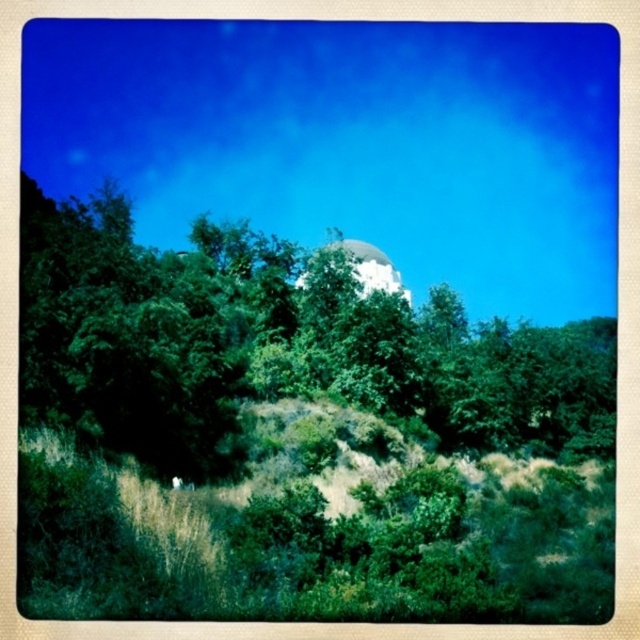
Looking at this image, is green leafy tree at center positioned before white glossy dome at center?

That is True.

Based on the photo, can you confirm if green leafy tree at center is wider than white glossy dome at center?

Yes.

Does point (268, 394) come closer to viewer compared to point (381, 282)?

Yes, point (268, 394) is in front of point (381, 282).

Locate an element on the screen. Image resolution: width=640 pixels, height=640 pixels. green leafy tree at center is located at coordinates (275, 346).

Is point (132, 452) behind point (211, 506)?

Yes, it is behind point (211, 506).

Between point (321, 280) and point (76, 458), which one is positioned in front?

Point (76, 458) is more forward.

Find the location of `green leafy tree at center`. green leafy tree at center is located at coordinates pyautogui.click(x=275, y=346).

Consider the image. Which is more to the right, green grassy hillside at lower center or white glossy dome at center?

From the viewer's perspective, green grassy hillside at lower center appears more on the right side.

Can you confirm if green grassy hillside at lower center is positioned above white glossy dome at center?

Incorrect, green grassy hillside at lower center is not positioned above white glossy dome at center.

Between point (356, 436) and point (371, 280), which one is positioned behind?

Positioned behind is point (371, 280).

This screenshot has width=640, height=640. I want to click on green grassy hillside at lower center, so click(x=317, y=532).